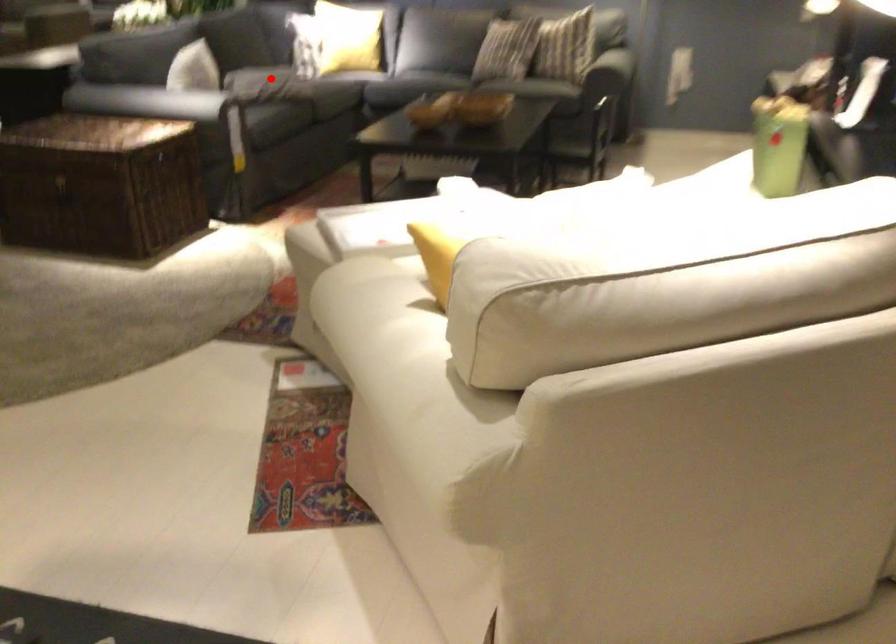
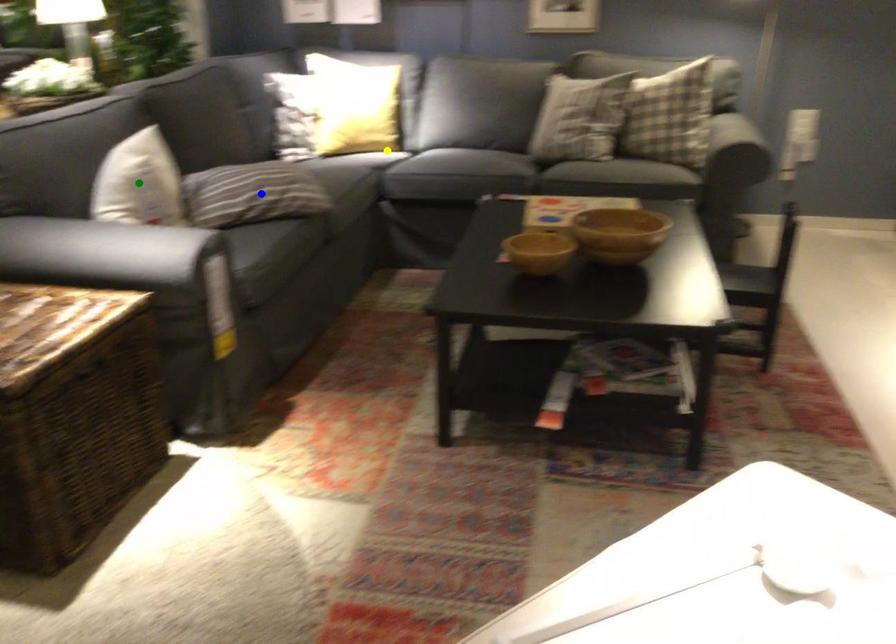
Question: I am providing you with two images of the same scene from different viewpoints. A red point is marked on the first image. You are given multiple points on the second image. In image 2, which mark is for the same physical point as the one in image 1?

Choices:
 (A) blue point
 (B) green point
 (C) yellow point

Answer: (A)